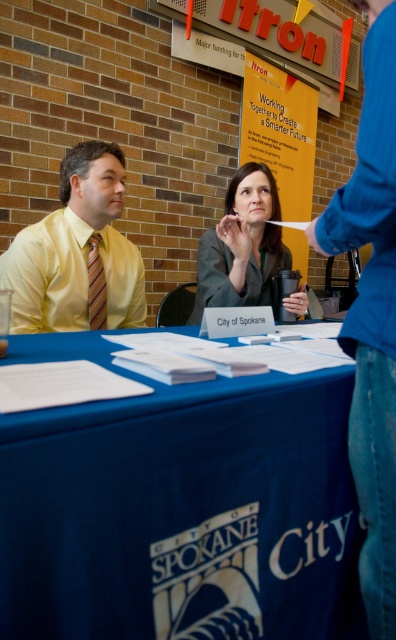
Question: Which point is farther to the camera?

Choices:
 (A) blue fabric table at center
 (B) yellow dress shirt at center

Answer: (B)

Question: Among these objects, which one is nearest to the camera?

Choices:
 (A) blue fabric table at center
 (B) matte paper poster at upper center
 (C) yellow satin shirt at left

Answer: (A)

Question: Can you confirm if yellow dress shirt at center is positioned to the left of matte paper poster at upper center?

Choices:
 (A) no
 (B) yes

Answer: (B)

Question: Is the position of yellow satin shirt at left more distant than that of matte paper poster at upper center?

Choices:
 (A) yes
 (B) no

Answer: (B)

Question: Which of these objects is positioned closest to the striped fabric tie at left?

Choices:
 (A) matte gray suit at center
 (B) yellow dress shirt at center
 (C) matte paper poster at upper center

Answer: (A)

Question: Can you confirm if blue fabric table at center is positioned below striped fabric tie at left?

Choices:
 (A) no
 (B) yes

Answer: (B)